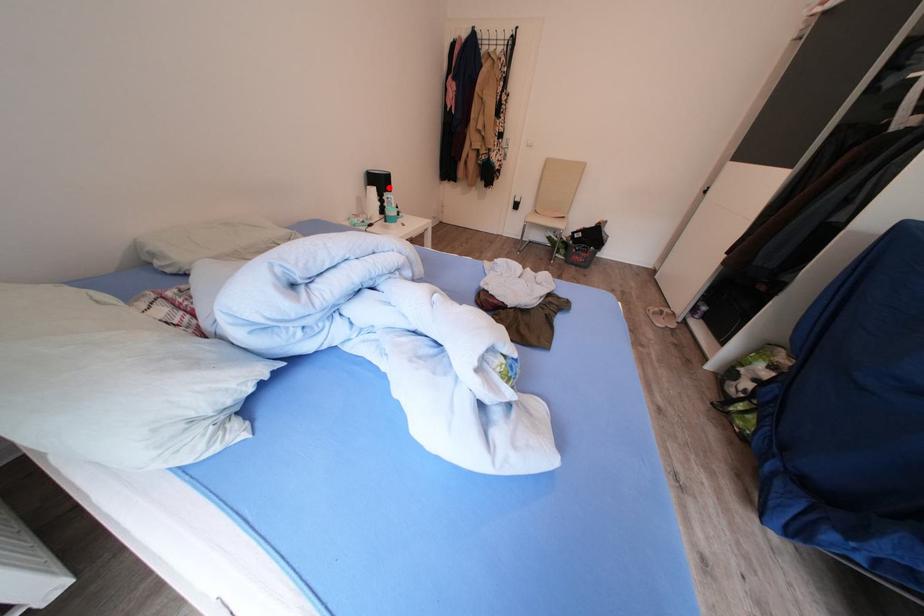
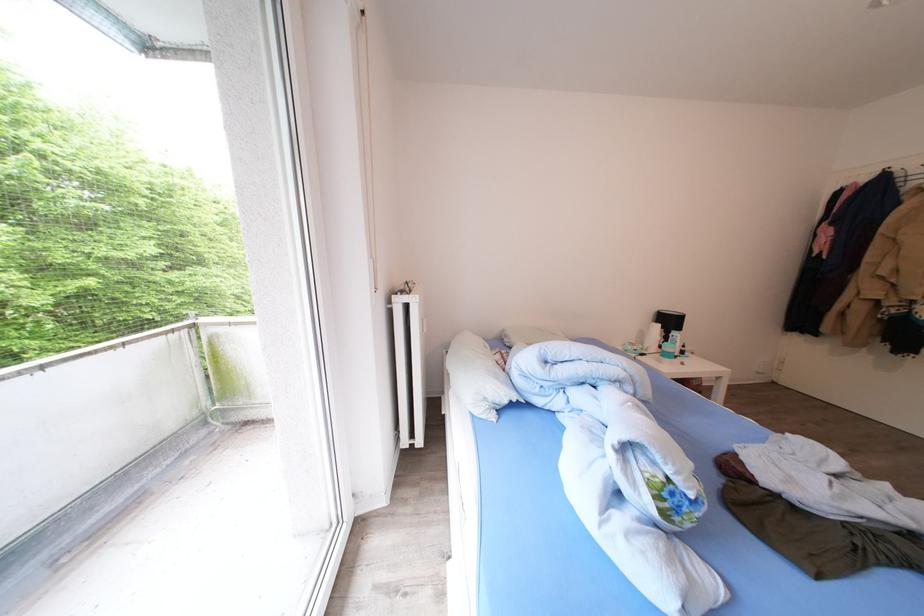
Question: I am providing you with two images of the same scene from different viewpoints. Image1 has a red point marked. In image2, the corresponding 3D location appears at what relative position? Reply with the corresponding letter.

Choices:
 (A) Closer
 (B) Farther

Answer: (B)